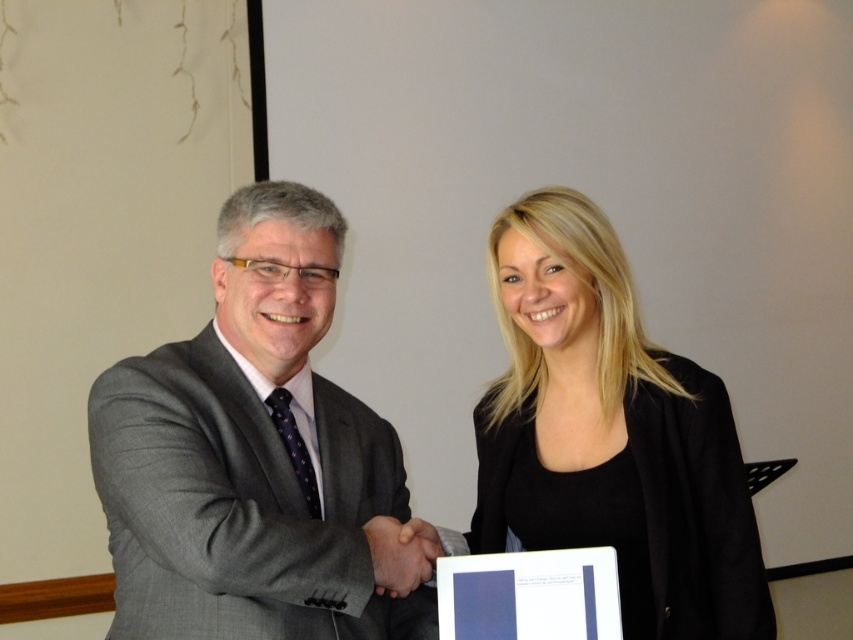
You are an event photographer who needs to capture a clear photo of both the gray suit at center and the black matte jacket at center. Based on their positions, which one is closer to the camera?

The gray suit at center is positioned over the black matte jacket at center, so the gray suit at center is closer to the camera.

You are standing in front of the two people shaking hands. There are two points marked in the image. One is at coordinate point [300,387] and the other is at coordinate point [408,536]. Which point is closer to you?

Point [300,387] is closer to you because it is further to the camera than point [408,536].

You are a photographer standing 1.2 meters away from the gray suit at center. Can you reach it to adjust its position without moving closer?

The gray suit at center is 1.10 meters away from the viewer, so you can reach it without moving closer since you are only 1.2 meters away.